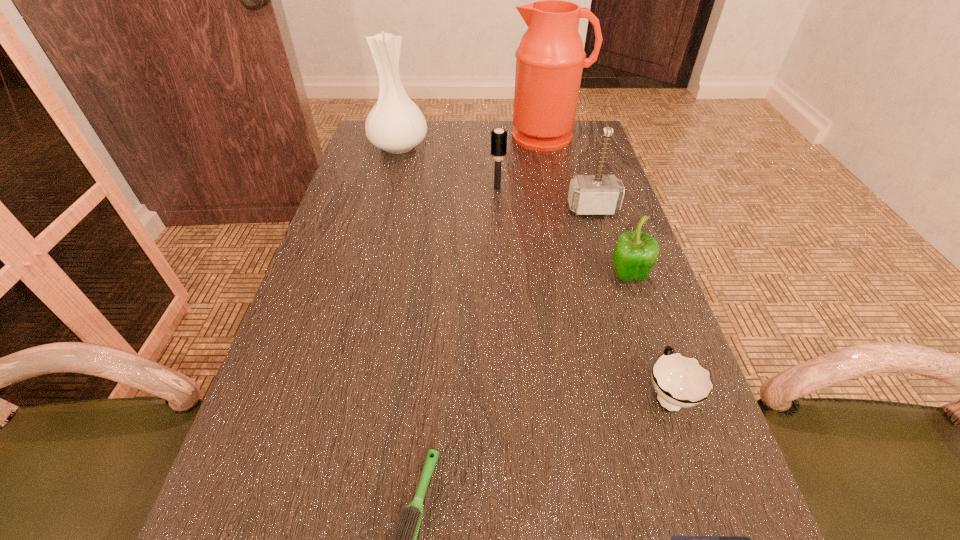
You are a GUI agent. You are given a task and a screenshot of the screen. Output one action in this format:
    pyautogui.click(x=<x>, y=<y>)
    Task: Click on the water jug
    
    Given the screenshot: What is the action you would take?
    pyautogui.click(x=550, y=59)

The image size is (960, 540). Find the location of `the leftmost object`. the leftmost object is located at coordinates (395, 124).

I want to click on the seventh shortest object, so click(395, 124).

Find the location of a particular element. hammer is located at coordinates (599, 194).

Where is `the fifth nearest object`? the fifth nearest object is located at coordinates [599, 194].

At what (x,y) coordinates should I click in order to perform the action: click on the third farthest object. Please return your answer as a coordinate pair (x, y). The height and width of the screenshot is (540, 960). Looking at the image, I should click on (498, 143).

The width and height of the screenshot is (960, 540). Identify the location of the farther hairbrush. (498, 143).

Find the location of a particular element. This screenshot has height=540, width=960. the fourth nearest object is located at coordinates (635, 253).

Identify the location of bell pepper. This screenshot has height=540, width=960. (635, 253).

Find the location of a particular element. Image resolution: width=960 pixels, height=540 pixels. the third shortest object is located at coordinates (680, 382).